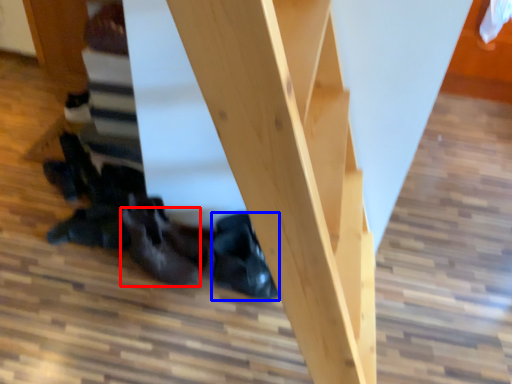
Question: Which object is closer to the camera taking this photo, leather shoe (highlighted by a red box) or leather shoe (highlighted by a blue box)?

Choices:
 (A) leather shoe
 (B) leather shoe

Answer: (A)